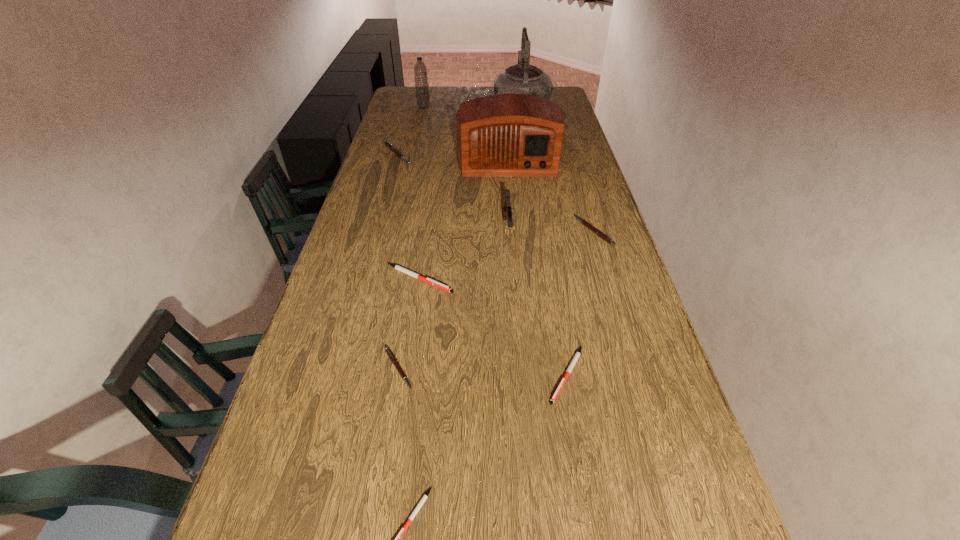
In order to click on the third farthest pen in this screenshot , I will do `click(397, 267)`.

At what (x,y) coordinates should I click in order to perform the action: click on the second pink pen from right to left. Please return your answer as a coordinate pair (x, y). The height and width of the screenshot is (540, 960). Looking at the image, I should click on (388, 351).

Image resolution: width=960 pixels, height=540 pixels. Find the location of `the nearest pink pen`. the nearest pink pen is located at coordinates (388, 351).

Identify the location of the second smallest white pen. (575, 358).

Where is `the rightmost white pen`? The height and width of the screenshot is (540, 960). the rightmost white pen is located at coordinates (575, 358).

I want to click on free space located at the spout of the kettle, so pos(517,88).

The height and width of the screenshot is (540, 960). In order to click on vacant space located 0.060m on the front-facing side of the radio receiver in this screenshot , I will do `click(511, 190)`.

You are a GUI agent. You are given a task and a screenshot of the screen. Output one action in this format:
    pyautogui.click(x=<x>, y=<y>)
    Task: Click on the blank space located on the left of the water bottle
    
    Given the screenshot: What is the action you would take?
    point(392,107)

What are the coordinates of `vacant region located 0.390m at the muzzle end of the seventh shortest object` in the screenshot? It's located at (517, 343).

This screenshot has height=540, width=960. I want to click on blank space located at the nib of the biggest pink pen, so click(506, 154).